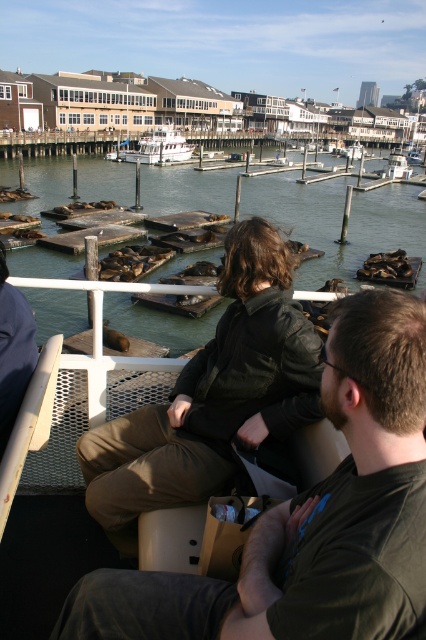
Question: Which of the following is the closest to the observer?

Choices:
 (A) dark brown leather jacket at center
 (B) white matte boat at center
 (C) greenish water at center
 (D) leather jacket at center

Answer: (A)

Question: Does leather jacket at center appear on the left side of white matte boat at center?

Choices:
 (A) no
 (B) yes

Answer: (A)

Question: Among these points, which one is farthest from the camera?

Choices:
 (A) [x=146, y=150]
 (B) [x=236, y=369]
 (C) [x=222, y=628]

Answer: (A)

Question: Estimate the real-world distances between objects in this image. Which object is closer to the leather jacket at center?

Choices:
 (A) white matte boat at center
 (B) greenish water at center

Answer: (B)

Question: Is dark brown leather jacket at center positioned behind leather jacket at center?

Choices:
 (A) yes
 (B) no

Answer: (B)

Question: Can you confirm if dark brown leather jacket at center is positioned above greenish water at center?

Choices:
 (A) no
 (B) yes

Answer: (A)